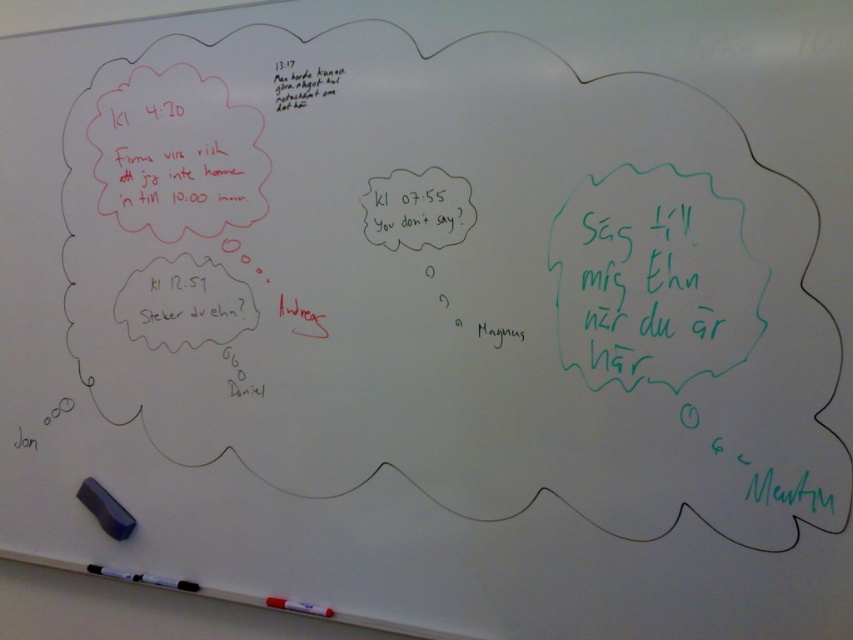
Question: From the image, what is the correct spatial relationship of white matte marker at lower left in relation to white matte marker at lower center?

Choices:
 (A) left
 (B) right

Answer: (A)

Question: Is white matte marker at lower left below white matte marker at lower center?

Choices:
 (A) yes
 (B) no

Answer: (B)

Question: Among these objects, which one is farthest from the camera?

Choices:
 (A) white matte marker at lower left
 (B) white matte marker at lower center

Answer: (A)

Question: Is white matte marker at lower left above white matte marker at lower center?

Choices:
 (A) no
 (B) yes

Answer: (B)

Question: Which point is farther to the camera?

Choices:
 (A) (119, 572)
 (B) (305, 611)

Answer: (A)